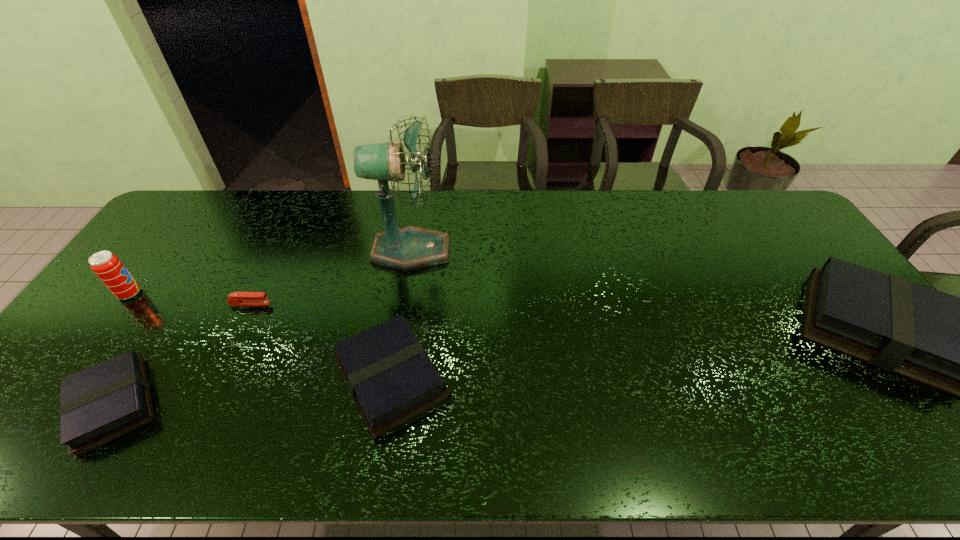
The height and width of the screenshot is (540, 960). I want to click on vacant spot for a new book to ensure equal spacing, so click(x=645, y=353).